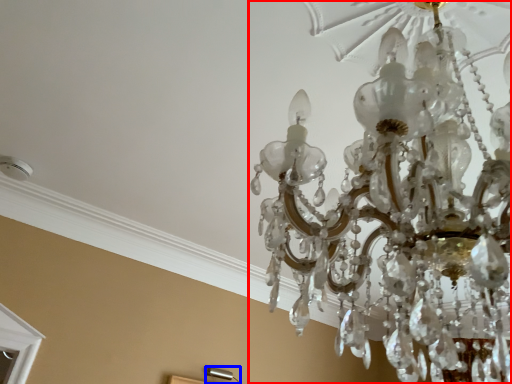
Question: Among these objects, which one is nearest to the camera, lamp (highlighted by a red box) or lamp (highlighted by a blue box)?

Choices:
 (A) lamp
 (B) lamp

Answer: (A)